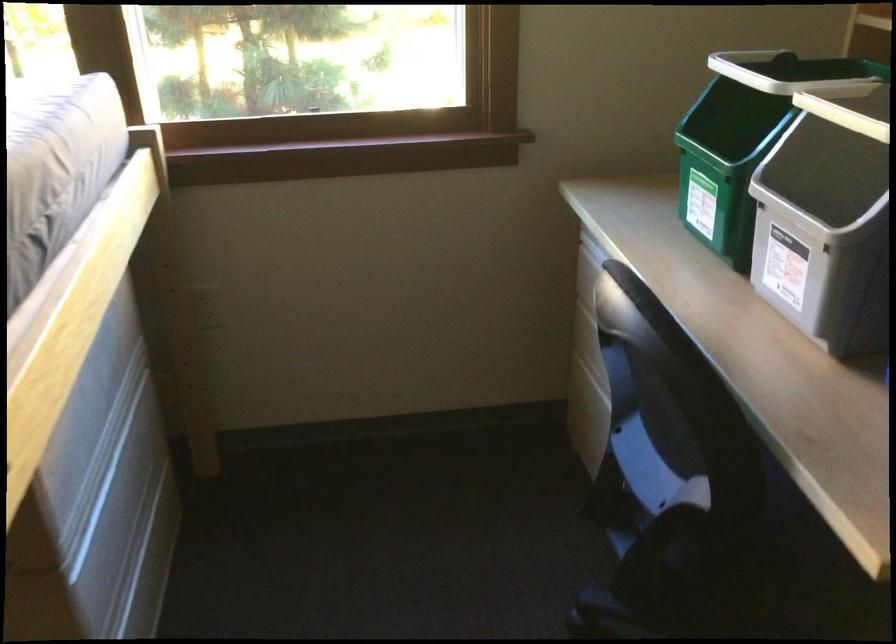
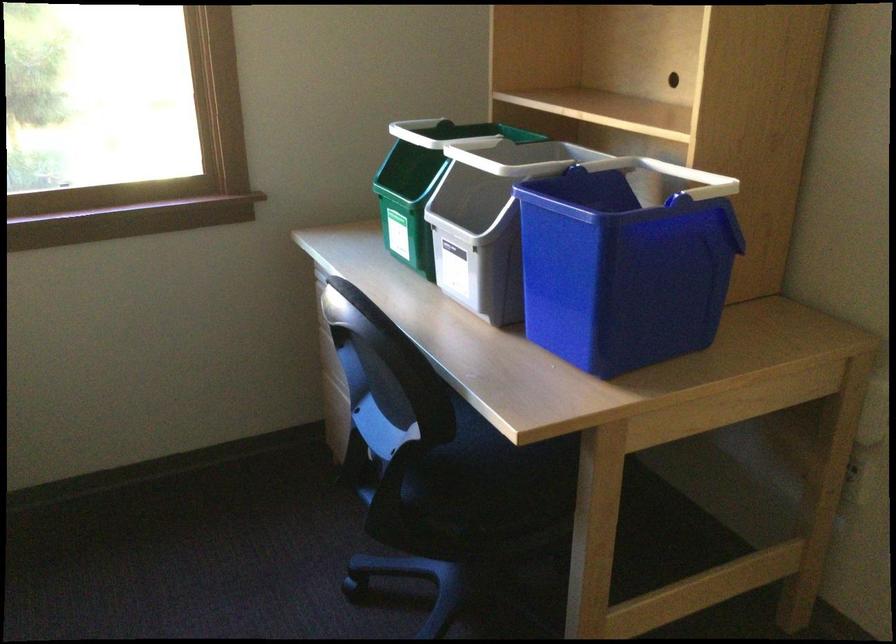
Locate, in the second image, the point that corresponds to [741,135] in the first image.

(421, 184)